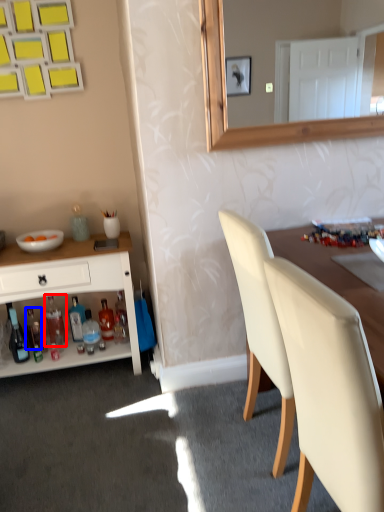
Question: Among these objects, which one is nearest to the camera, bottle (highlighted by a red box) or bottle (highlighted by a blue box)?

Choices:
 (A) bottle
 (B) bottle

Answer: (A)